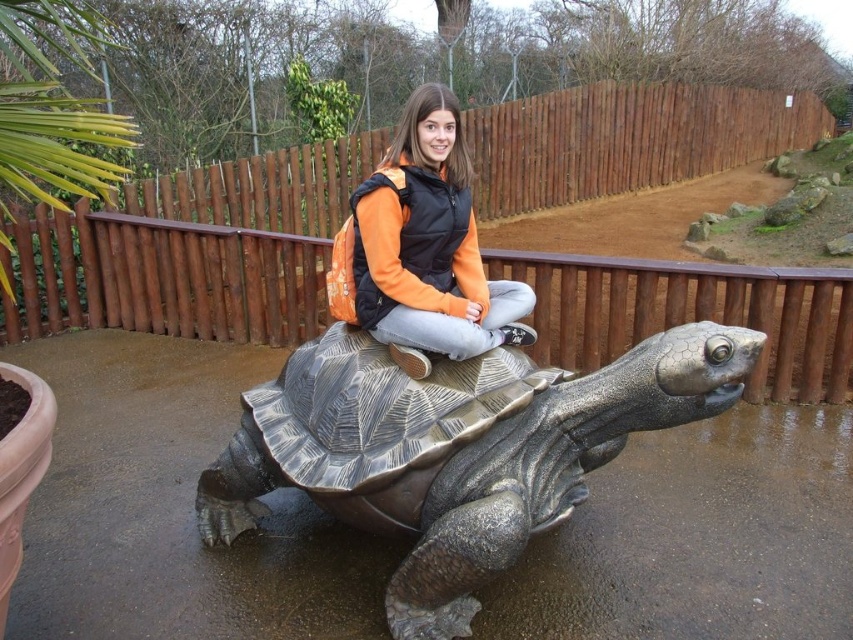
You are a photographer standing in front of the metallic tortoise at center and the orange fabric jacket at center. You want to take a photo that includes both objects in the frame. Based on their positions, which object should you focus on first to ensure both are in the frame?

The metallic tortoise at center is located below the orange fabric jacket at center. To include both in the frame, focus on the metallic tortoise at center first since it is lower and the jacket is above it, allowing you to adjust the camera angle to capture both.

You are a photographer trying to capture a photo of the metallic tortoise at center and the orange fabric jacket at center. You need to ensure that both subjects are in focus. Given that your camera can only maintain focus on objects within a 40 cm range of each other, will both subjects be in focus?

The metallic tortoise at center is 45.30 centimeters from the orange fabric jacket at center. Since the distance exceeds the camera focus range of 40 cm, both subjects cannot be in focus simultaneously.

You are a photographer trying to capture a photo of the metallic tortoise at center and the orange fabric jacket at center. Which object should you focus on first if you want to include both in your shot without moving the camera?

A: The metallic tortoise at center is positioned on the left side of the orange fabric jacket at center, so you should focus on the metallic tortoise at center first to ensure both are in frame.